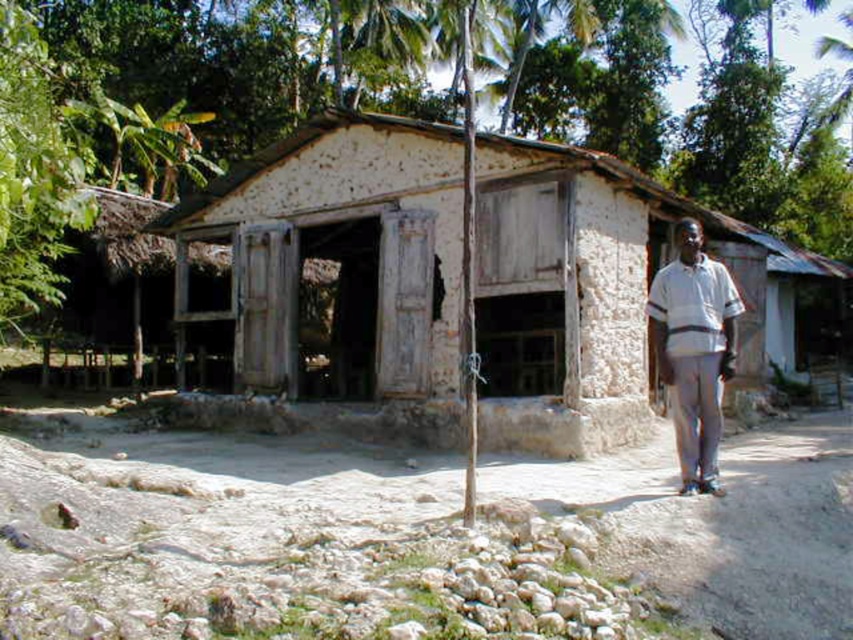
Question: Is brown dirt track at lower center closer to the viewer compared to white stucco hut at center?

Choices:
 (A) yes
 (B) no

Answer: (A)

Question: Which of these objects is positioned closest to the brown dirt track at lower center?

Choices:
 (A) white striped shirt at right
 (B) white stucco hut at center

Answer: (A)

Question: Does brown dirt track at lower center appear on the right side of white stucco hut at center?

Choices:
 (A) no
 (B) yes

Answer: (A)

Question: Which object is positioned closest to the white striped shirt at right?

Choices:
 (A) brown dirt track at lower center
 (B) white stucco hut at center

Answer: (A)

Question: Which of the following is the closest to the observer?

Choices:
 (A) (537, 252)
 (B) (682, 227)

Answer: (B)

Question: Can you confirm if brown dirt track at lower center is positioned below white stucco hut at center?

Choices:
 (A) yes
 (B) no

Answer: (A)